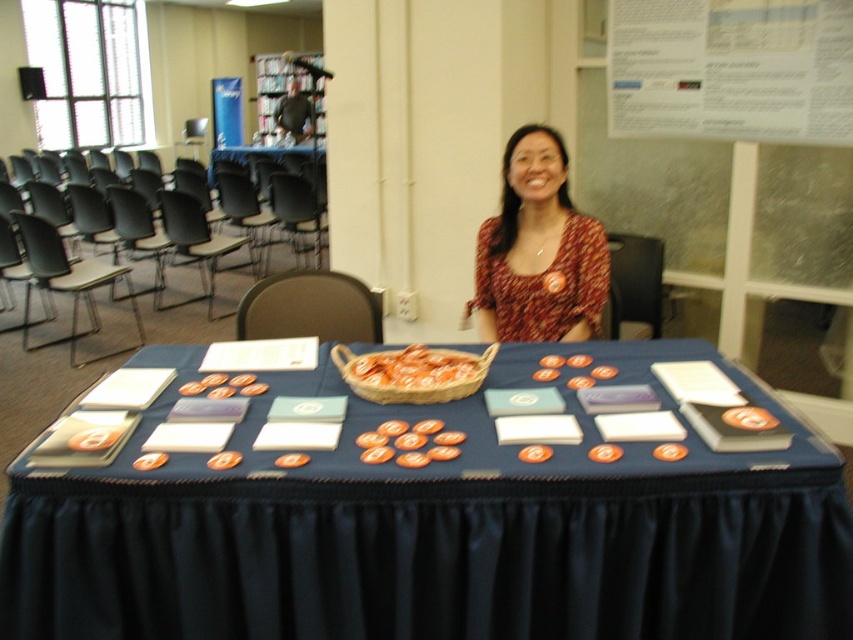
You are a person who is 1.7 meters tall and standing behind the blue fabric table at center. You want to pick up the orange matte basket at center without bending down. Is the basket within your reach height?

The blue fabric table at center has a greater height compared to orange matte basket at center. Since the table is higher than the basket, the basket is likely placed on the table. Therefore, you can reach it without bending down as it is on the table surface.

You are organizing a meeting and need to place a large folder on the table. Given the sizes of the objects present, will the blue fabric table at center have enough space to accommodate the folder without overlapping the printed fabric blouse at center?

The blue fabric table at center has a larger size compared to printed fabric blouse at center, so it is likely there is enough space to place the large folder without overlapping the blouse.

Where is the printed fabric blouse at center located in the image?

The printed fabric blouse at center is located at point (x=538, y=250) in the image.